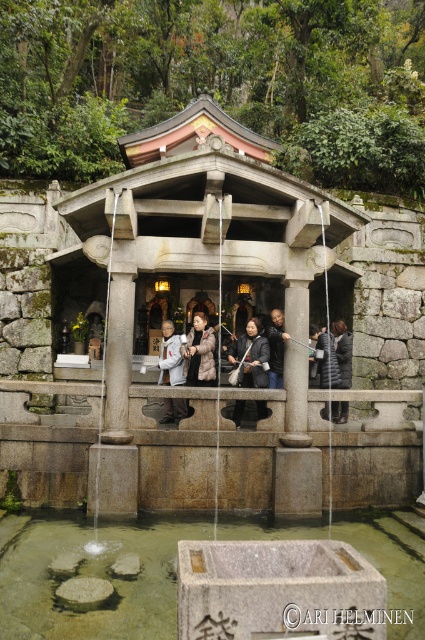
Can you confirm if black leather jacket at center is bigger than dark gray stone person at center?

Yes.

Who is taller, black leather jacket at center or dark gray stone person at center?

With more height is black leather jacket at center.

Is point (266, 381) less distant than point (175, 404)?

Yes.

I want to click on black leather jacket at center, so click(x=251, y=356).

Measure the distance between point (167, 403) and camera.

Point (167, 403) and camera are 15.84 meters apart.

Does dark gray stone person at center appear on the left side of dark gray fabric jacket at center?

Indeed, dark gray stone person at center is positioned on the left side of dark gray fabric jacket at center.

The height and width of the screenshot is (640, 425). Identify the location of dark gray stone person at center. (170, 356).

What do you see at coordinates (334, 356) in the screenshot? I see `dark gray down jacket at center` at bounding box center [334, 356].

Who is positioned more to the left, dark gray down jacket at center or dark gray fabric jacket at center?

Positioned to the left is dark gray fabric jacket at center.

Does point (339, 362) come behind point (283, 314)?

Yes, point (339, 362) is farther from viewer.

Identify the location of dark gray down jacket at center. Image resolution: width=425 pixels, height=640 pixels. (334, 356).